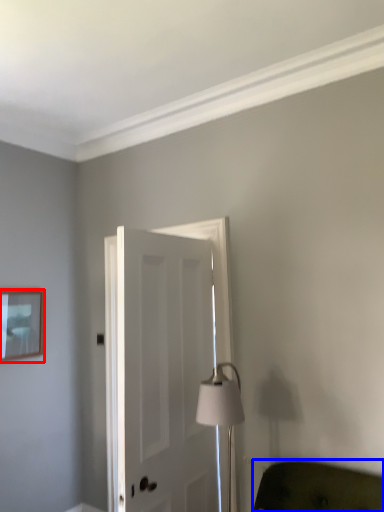
Question: Among these objects, which one is nearest to the camera, picture frame (highlighted by a red box) or furniture (highlighted by a blue box)?

Choices:
 (A) picture frame
 (B) furniture

Answer: (B)